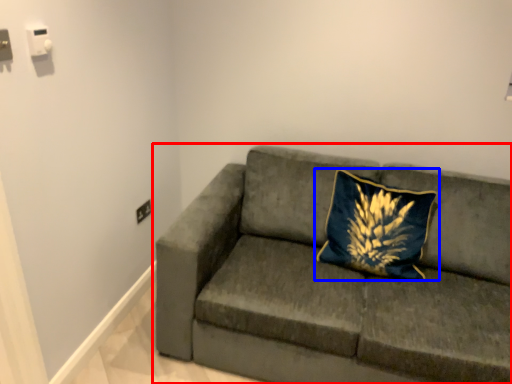
Question: Which point is closer to the camera, studio couch (highlighted by a red box) or pillow (highlighted by a blue box)?

Choices:
 (A) studio couch
 (B) pillow

Answer: (A)